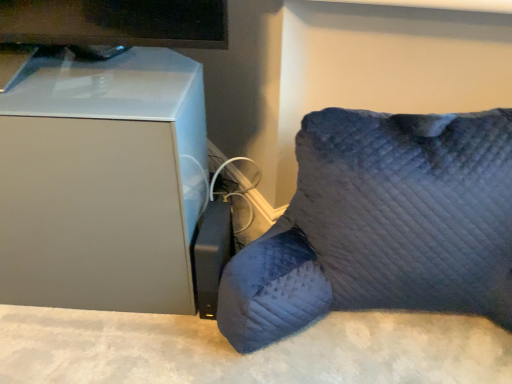
This screenshot has height=384, width=512. Describe the element at coordinates (102, 182) in the screenshot. I see `white matte mini fridge at left, acting as the 1th furniture starting from the left` at that location.

How much space does white matte mini fridge at left, the 2th furniture when ordered from right to left, occupy horizontally?

white matte mini fridge at left, the 2th furniture when ordered from right to left, is 13.73 inches wide.

Where is `white matte mini fridge at left, acting as the 1th furniture starting from the left`? white matte mini fridge at left, acting as the 1th furniture starting from the left is located at coordinates (102, 182).

Find the location of a particular element. This screenshot has height=384, width=512. dark blue quilted pillow at lower right, which is the 1th furniture in right-to-left order is located at coordinates (381, 225).

What do you see at coordinates (381, 225) in the screenshot? The image size is (512, 384). I see `dark blue quilted pillow at lower right, arranged as the 2th furniture when viewed from the left` at bounding box center [381, 225].

What are the coordinates of `white matte mini fridge at left, the 2th furniture when ordered from right to left` in the screenshot? It's located at (102, 182).

Is white matte mini fridge at left, the 2th furniture when ordered from right to left, to the left of dark blue quilted pillow at lower right, arranged as the 2th furniture when viewed from the left, from the viewer's perspective?

Yes.

In the scene shown: Is the position of white matte mini fridge at left, the 2th furniture when ordered from right to left, less distant than that of dark blue quilted pillow at lower right, arranged as the 2th furniture when viewed from the left?

No, the depth of white matte mini fridge at left, the 2th furniture when ordered from right to left, is greater than that of dark blue quilted pillow at lower right, arranged as the 2th furniture when viewed from the left.

Considering the points (78, 220) and (484, 127), which point is in front, point (78, 220) or point (484, 127)?

The point (78, 220) is in front.

From the image's perspective, would you say white matte mini fridge at left, acting as the 1th furniture starting from the left, is positioned over dark blue quilted pillow at lower right, which is the 1th furniture in right-to-left order?

Yes.

From a real-world perspective, is white matte mini fridge at left, acting as the 1th furniture starting from the left, located beneath dark blue quilted pillow at lower right, arranged as the 2th furniture when viewed from the left?

Actually, white matte mini fridge at left, acting as the 1th furniture starting from the left, is physically above dark blue quilted pillow at lower right, arranged as the 2th furniture when viewed from the left, in the real world.

Considering the relative sizes of white matte mini fridge at left, acting as the 1th furniture starting from the left, and dark blue quilted pillow at lower right, which is the 1th furniture in right-to-left order, in the image provided, is white matte mini fridge at left, acting as the 1th furniture starting from the left, wider than dark blue quilted pillow at lower right, which is the 1th furniture in right-to-left order,?

No, white matte mini fridge at left, acting as the 1th furniture starting from the left, is not wider than dark blue quilted pillow at lower right, which is the 1th furniture in right-to-left order.

Considering the sizes of white matte mini fridge at left, acting as the 1th furniture starting from the left, and dark blue quilted pillow at lower right, arranged as the 2th furniture when viewed from the left, in the image, is white matte mini fridge at left, acting as the 1th furniture starting from the left, taller or shorter than dark blue quilted pillow at lower right, arranged as the 2th furniture when viewed from the left,?

white matte mini fridge at left, acting as the 1th furniture starting from the left, is taller than dark blue quilted pillow at lower right, arranged as the 2th furniture when viewed from the left.

Does white matte mini fridge at left, acting as the 1th furniture starting from the left, have a smaller size compared to dark blue quilted pillow at lower right, which is the 1th furniture in right-to-left order?

Yes, white matte mini fridge at left, acting as the 1th furniture starting from the left, is smaller than dark blue quilted pillow at lower right, which is the 1th furniture in right-to-left order.

Is dark blue quilted pillow at lower right, which is the 1th furniture in right-to-left order, surrounded by white matte mini fridge at left, acting as the 1th furniture starting from the left?

Result: Actually, dark blue quilted pillow at lower right, which is the 1th furniture in right-to-left order, is outside white matte mini fridge at left, acting as the 1th furniture starting from the left.

Are white matte mini fridge at left, acting as the 1th furniture starting from the left, and dark blue quilted pillow at lower right, which is the 1th furniture in right-to-left order, beside each other?

No, white matte mini fridge at left, acting as the 1th furniture starting from the left, is not with dark blue quilted pillow at lower right, which is the 1th furniture in right-to-left order.

Is white matte mini fridge at left, acting as the 1th furniture starting from the left, oriented towards dark blue quilted pillow at lower right, which is the 1th furniture in right-to-left order?

No, white matte mini fridge at left, acting as the 1th furniture starting from the left, is not aimed at dark blue quilted pillow at lower right, which is the 1th furniture in right-to-left order.

How different are the orientations of white matte mini fridge at left, acting as the 1th furniture starting from the left, and dark blue quilted pillow at lower right, arranged as the 2th furniture when viewed from the left, in degrees?

They differ by 2.59 degrees in their facing directions.

Locate an element on the screen. The image size is (512, 384). furniture that appears above the dark blue quilted pillow at lower right, which is the 1th furniture in right-to-left order (from the image's perspective) is located at coordinates (102, 182).

Considering the relative positions of dark blue quilted pillow at lower right, which is the 1th furniture in right-to-left order, and white matte mini fridge at left, the 2th furniture when ordered from right to left, in the image provided, is dark blue quilted pillow at lower right, which is the 1th furniture in right-to-left order, to the right of white matte mini fridge at left, the 2th furniture when ordered from right to left, from the viewer's perspective?

Yes.

Which is in front, dark blue quilted pillow at lower right, which is the 1th furniture in right-to-left order, or white matte mini fridge at left, acting as the 1th furniture starting from the left?

dark blue quilted pillow at lower right, which is the 1th furniture in right-to-left order, is in front.

Which point is more forward, (381, 300) or (77, 280)?

Positioned in front is point (381, 300).

From the image's perspective, which one is positioned lower, dark blue quilted pillow at lower right, arranged as the 2th furniture when viewed from the left, or white matte mini fridge at left, the 2th furniture when ordered from right to left?

dark blue quilted pillow at lower right, arranged as the 2th furniture when viewed from the left, is shown below in the image.

From a real-world perspective, which is physically above, dark blue quilted pillow at lower right, arranged as the 2th furniture when viewed from the left, or white matte mini fridge at left, the 2th furniture when ordered from right to left?

white matte mini fridge at left, the 2th furniture when ordered from right to left, is physically above.

Is dark blue quilted pillow at lower right, arranged as the 2th furniture when viewed from the left, wider than white matte mini fridge at left, acting as the 1th furniture starting from the left?

Yes.

Between dark blue quilted pillow at lower right, which is the 1th furniture in right-to-left order, and white matte mini fridge at left, the 2th furniture when ordered from right to left, which one has less height?

With less height is dark blue quilted pillow at lower right, which is the 1th furniture in right-to-left order.

Is dark blue quilted pillow at lower right, arranged as the 2th furniture when viewed from the left, smaller than white matte mini fridge at left, the 2th furniture when ordered from right to left?

Actually, dark blue quilted pillow at lower right, arranged as the 2th furniture when viewed from the left, might be larger than white matte mini fridge at left, the 2th furniture when ordered from right to left.

Looking at this image, is dark blue quilted pillow at lower right, arranged as the 2th furniture when viewed from the left, inside or outside of white matte mini fridge at left, acting as the 1th furniture starting from the left?

dark blue quilted pillow at lower right, arranged as the 2th furniture when viewed from the left, is outside white matte mini fridge at left, acting as the 1th furniture starting from the left.

Is dark blue quilted pillow at lower right, arranged as the 2th furniture when viewed from the left, next to white matte mini fridge at left, the 2th furniture when ordered from right to left, and touching it?

They are not placed beside each other.

Is dark blue quilted pillow at lower right, arranged as the 2th furniture when viewed from the left, turned away from white matte mini fridge at left, the 2th furniture when ordered from right to left?

No, dark blue quilted pillow at lower right, arranged as the 2th furniture when viewed from the left,'s orientation is not away from white matte mini fridge at left, the 2th furniture when ordered from right to left.

Could you measure the distance between dark blue quilted pillow at lower right, arranged as the 2th furniture when viewed from the left, and white matte mini fridge at left, the 2th furniture when ordered from right to left?

dark blue quilted pillow at lower right, arranged as the 2th furniture when viewed from the left, is 13.13 inches from white matte mini fridge at left, the 2th furniture when ordered from right to left.

There is a dark blue quilted pillow at lower right, which is the 1th furniture in right-to-left order. Where is `furniture above it (from a real-world perspective)`? The image size is (512, 384). furniture above it (from a real-world perspective) is located at coordinates (102, 182).

At what (x,y) coordinates should I click in order to perform the action: click on furniture behind the dark blue quilted pillow at lower right, which is the 1th furniture in right-to-left order. Please return your answer as a coordinate pair (x, y). Looking at the image, I should click on (102, 182).

Where is `furniture located underneath the white matte mini fridge at left, acting as the 1th furniture starting from the left (from a real-world perspective)`? The width and height of the screenshot is (512, 384). furniture located underneath the white matte mini fridge at left, acting as the 1th furniture starting from the left (from a real-world perspective) is located at coordinates (381, 225).